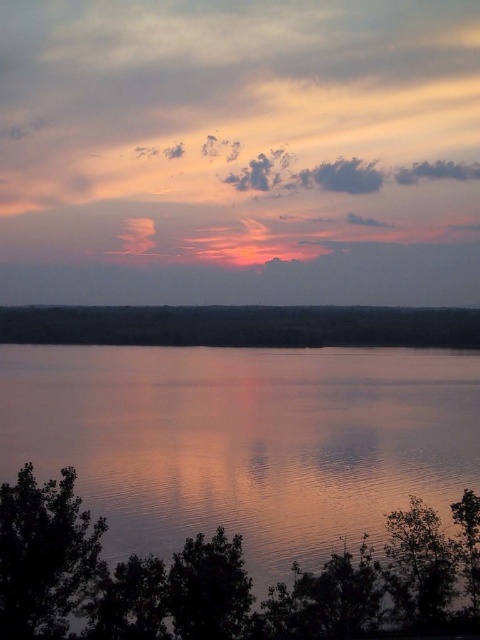
Consider the image. You are standing at the edge of the water and want to place a small floating decoration. The smooth reflective water at center is closer to you than the smooth dark water at center. Which area should you aim for to ensure the decoration stays closer to your position?

You should aim for the smooth reflective water at center because it is closer to you compared to the smooth dark water at center.

You are standing at the edge of the water in the sunset scene and see two points on the horizon. The first point is labeled as point (292, 371) and the second is point (256, 308). Which point appears closer to you?

Point (292, 371) appears closer to you because it is in front of point (256, 308).

You are an artist planning to paint the sunset scene. You notice two areas of water in the image. The first is the smooth reflective water at center, and the second is the smooth dark water at center. Which of these two water areas appears taller in the painting?

The smooth reflective water at center appears taller than the smooth dark water at center in the painting.